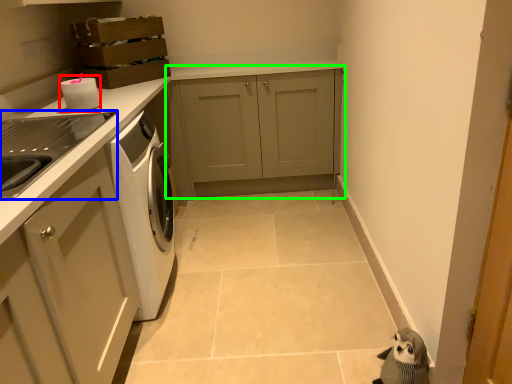
Question: Based on their relative distances, which object is farther from appliance (highlighted by a red box)? Choose from home appliance (highlighted by a blue box) and cabinetry (highlighted by a green box).

Choices:
 (A) home appliance
 (B) cabinetry

Answer: (B)